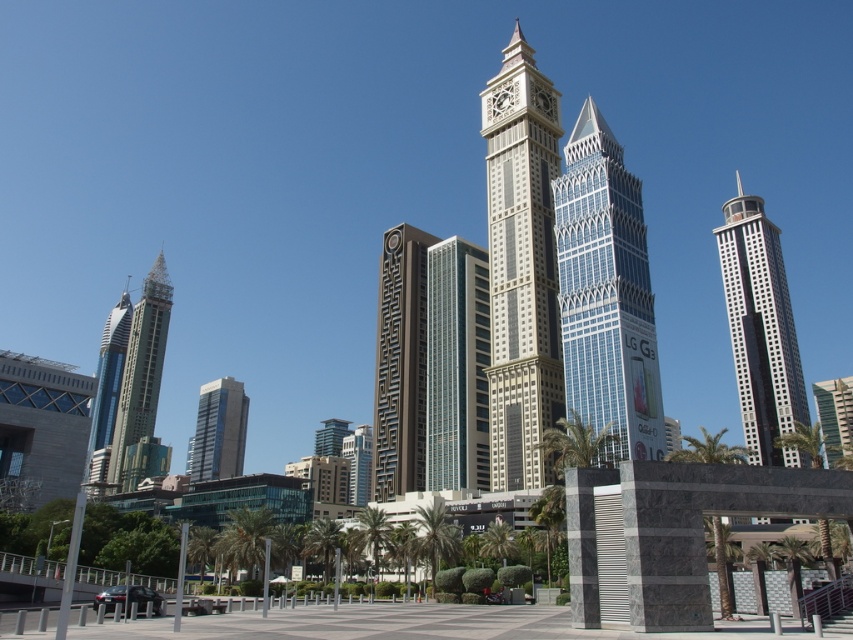
You are a city planner reviewing the urban layout. You notice the clear glass skyscraper at center and the brown textured tower at center. Which one is located to the right of the other?

The clear glass skyscraper at center is positioned on the right side of the brown textured tower at center.

You are standing at the camera position and want to take a photo of the blue glass skyscraper at center. If your camera has a maximum zoom range of 100 meters, can you capture the entire skyscraper in one shot without moving?

The blue glass skyscraper at center and camera are 178.12 meters apart. Since the maximum zoom range is 100 meters, the camera cannot capture the entire skyscraper in one shot without moving.